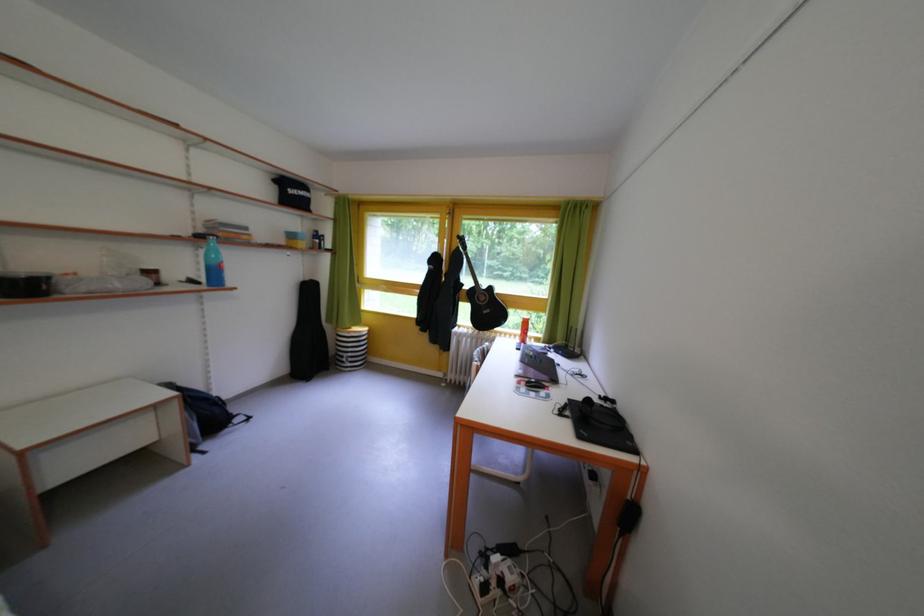
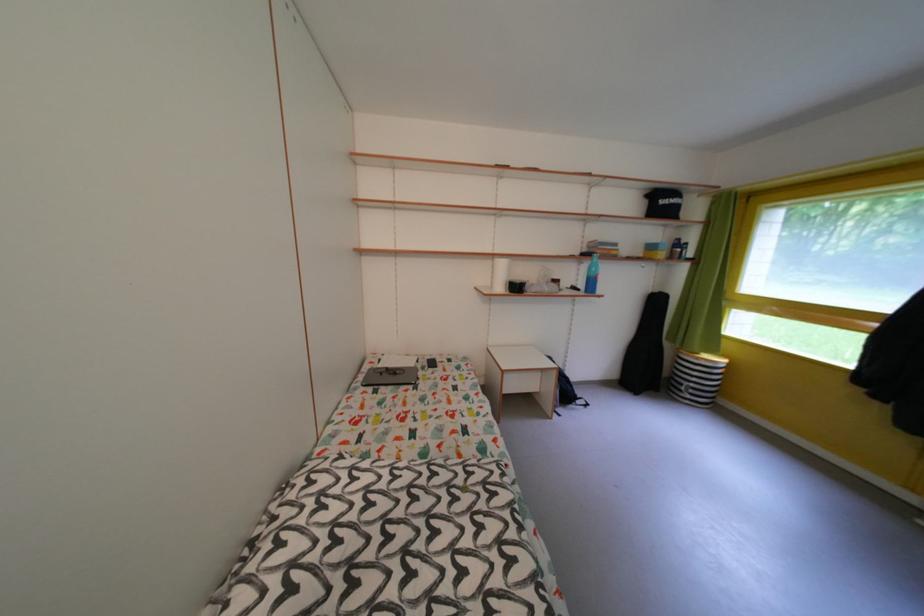
Question: The camera is either moving clockwise (left) or counter-clockwise (right) around the object. The first image is from the beginning of the video and the second image is from the end. Is the camera moving left or right when shooting the video?

Choices:
 (A) Left
 (B) Right

Answer: (B)